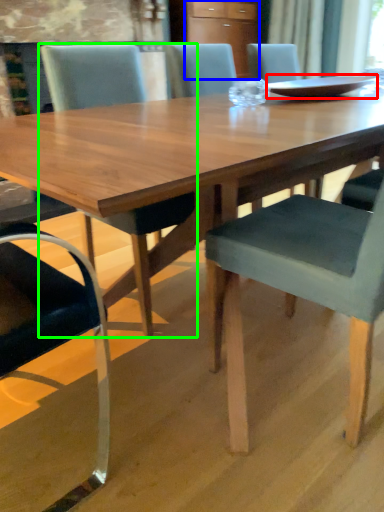
Question: Considering the real-world distances, which object is farthest from tray (highlighted by a red box)? cabinetry (highlighted by a blue box) or chair (highlighted by a green box)?

Choices:
 (A) cabinetry
 (B) chair

Answer: (A)